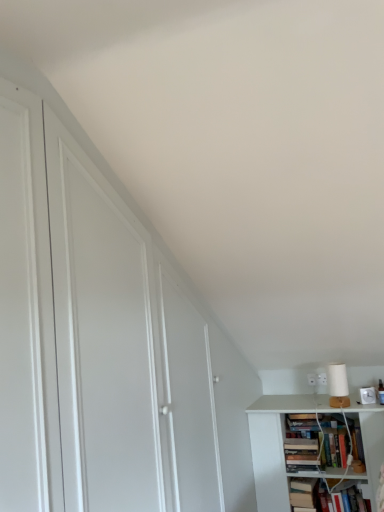
Question: From a real-world perspective, is white matte lamp at upper right above or below hardcover book at lower right, which is counted as the first book, starting from the right?

Choices:
 (A) above
 (B) below

Answer: (A)

Question: Is white matte lamp at upper right wider or thinner than hardcover book at lower right, which is counted as the first book, starting from the right?

Choices:
 (A) wide
 (B) thin

Answer: (B)

Question: Estimate the real-world distances between objects in this image. Which object is closer to the white matte lamp at upper right?

Choices:
 (A) hardcover book at lower right, which is counted as the first book, starting from the right
 (B) hardcover book at lower right, which is the first book in left-to-right order

Answer: (A)

Question: Based on their relative distances, which object is farther from the white matte lamp at upper right?

Choices:
 (A) hardcover book at lower right, which is the first book in left-to-right order
 (B) hardcover book at lower right, which is counted as the first book, starting from the right

Answer: (A)